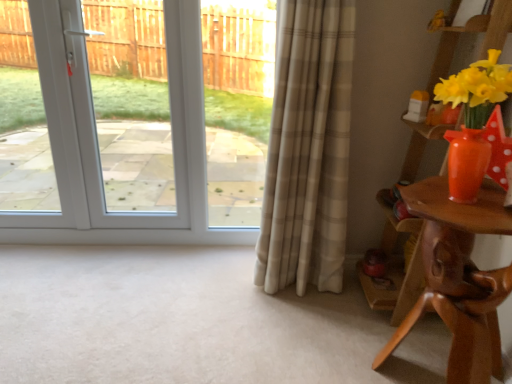
Question: Is brown wooden table at right taller or shorter than matte orange vase at right?

Choices:
 (A) short
 (B) tall

Answer: (B)

Question: Is point (495, 319) closer or farther from the camera than point (464, 77)?

Choices:
 (A) closer
 (B) farther

Answer: (B)

Question: Which of these objects is positioned closest to the matte orange vase at right?

Choices:
 (A) brown wooden table at right
 (B) white glossy door at upper left
 (C) beige plaid curtain at center

Answer: (A)

Question: Considering the real-world distances, which object is farthest from the beige plaid curtain at center?

Choices:
 (A) matte orange vase at right
 (B) brown wooden table at right
 (C) white glossy door at upper left

Answer: (C)